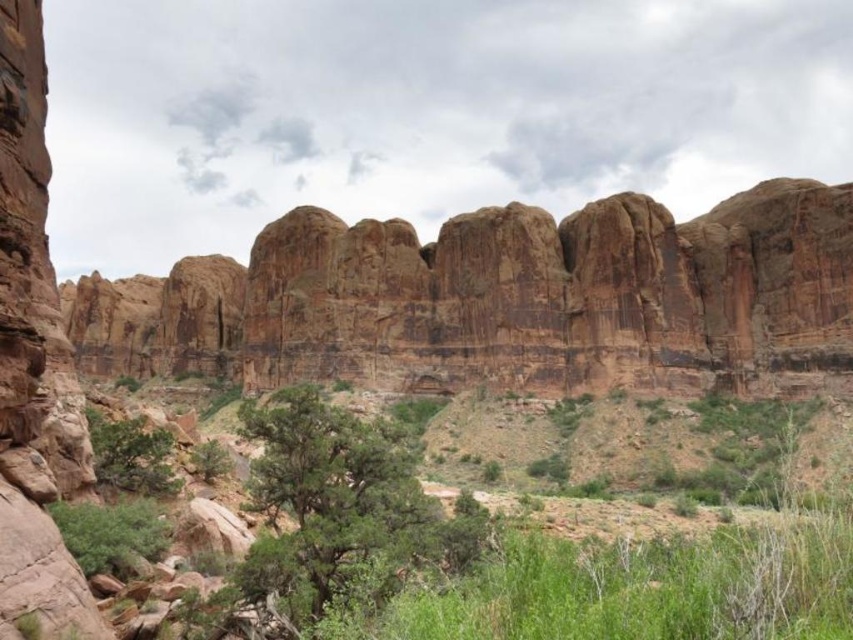
Who is more distant from viewer, (512,556) or (112,524)?

Positioned behind is point (112,524).

I want to click on green leafy shrubs at center, so click(529, 544).

Locate an element on the screen. This screenshot has width=853, height=640. green leafy shrubs at center is located at coordinates (529, 544).

Can you confirm if green leafy shrubs at center is thinner than green leafy shrub at center?

Incorrect, green leafy shrubs at center's width is not less than green leafy shrub at center's.

Locate an element on the screen. green leafy shrubs at center is located at coordinates (529, 544).

Identify the location of green leafy shrubs at center. (529, 544).

Between rustic sandstone cliffs at center and green leafy shrubs at center, which one has less height?

green leafy shrubs at center is shorter.

Is point (509, 237) in front of point (338, 589)?

No, it is not.

Between point (608, 321) and point (424, 464), which one is positioned behind?

The point (608, 321) is behind.

The image size is (853, 640). Find the location of `rustic sandstone cliffs at center`. rustic sandstone cliffs at center is located at coordinates (500, 298).